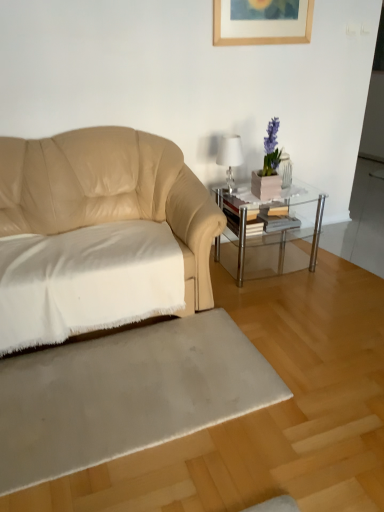
Image resolution: width=384 pixels, height=512 pixels. Identify the location of free space below clear glass table at center (from a real-world perspective). (265, 263).